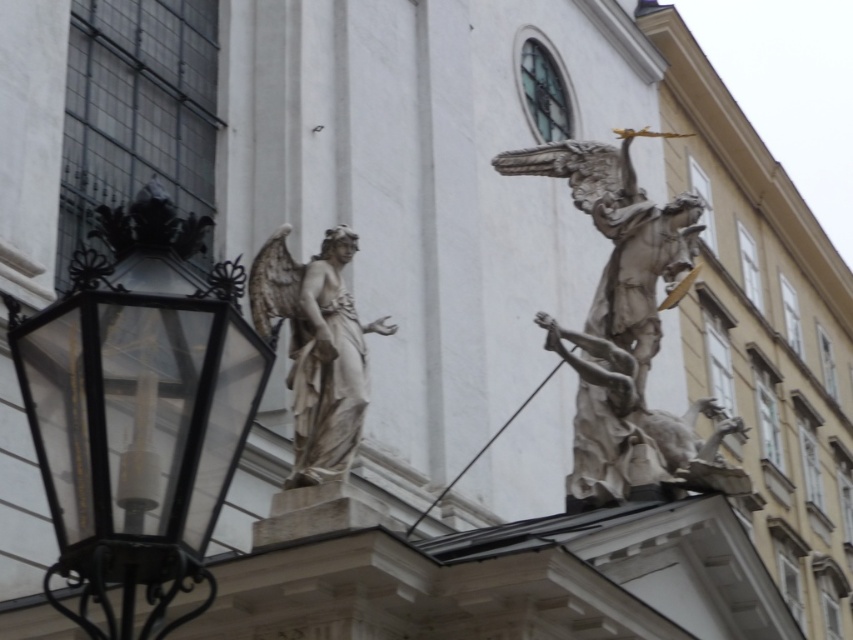
You are an architect assessing the building facade. You need to determine if the black glass lantern at left can be moved to the position of the white marble sculpture at upper right without altering the structural balance. Based on their widths, what should you consider?

The black glass lantern at left is wider than the white marble sculpture at upper right. Moving it might disrupt the balance since its greater width could make the area appear heavier compared to the original sculpture.

You are an art student analyzing the classical building. You notice the white marble sculpture at upper right and the white marble statue at center. Which one appears larger in size?

The white marble sculpture at upper right is bigger than the white marble statue at center.

You are an architect examining the building facade. You notice a point marked at coordinates (627, 332). What does this point indicate?

The point at (627, 332) marks the location of the white marble sculpture at upper right.